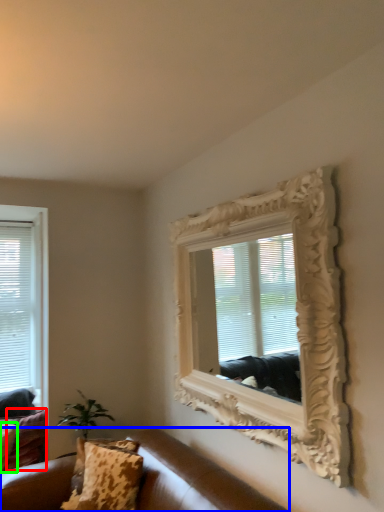
Question: Based on their relative distances, which object is nearer to pillow (highlighted by a red box)? Choose from studio couch (highlighted by a blue box) and pillow (highlighted by a green box).

Choices:
 (A) studio couch
 (B) pillow

Answer: (B)